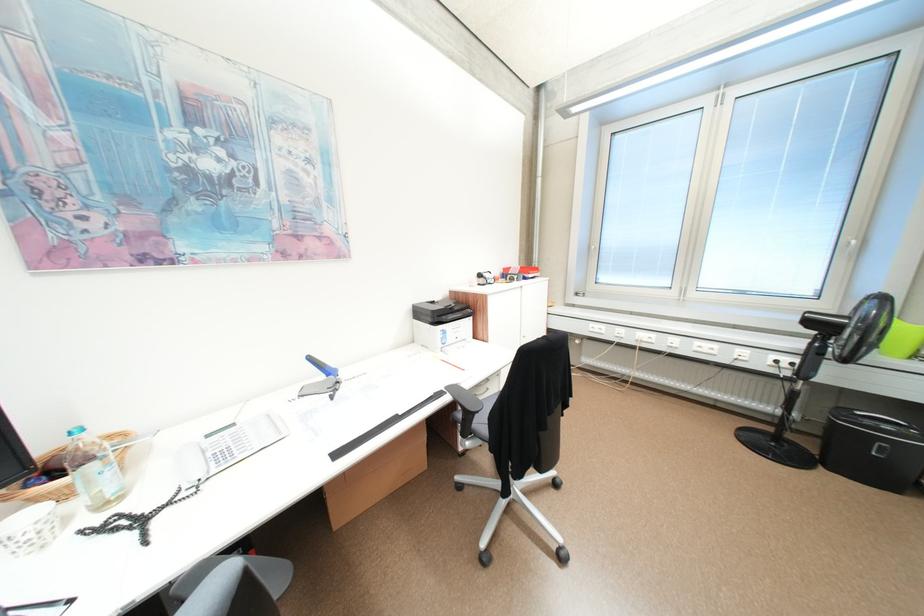
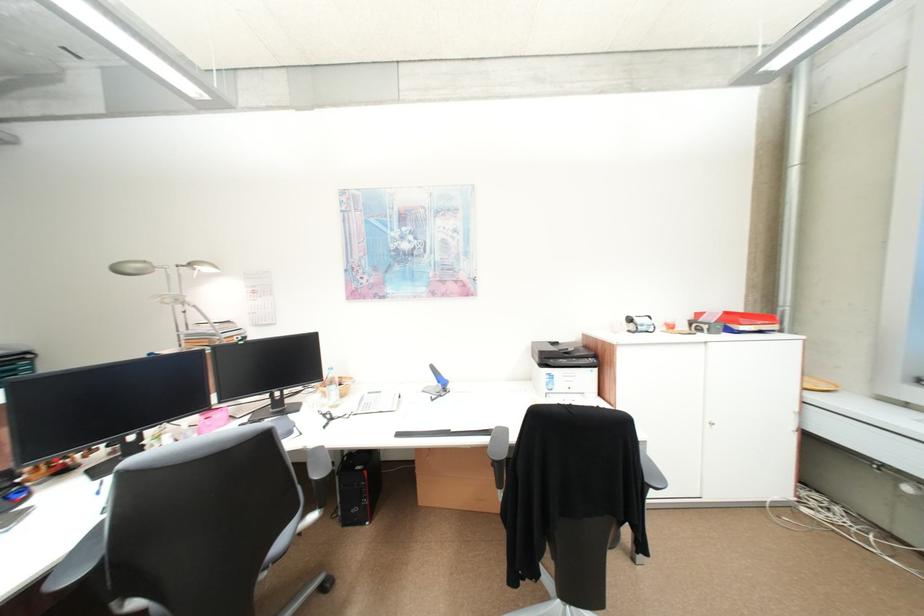
Where in the second image is the point corresponding to (x=541, y=276) from the first image?

(754, 329)